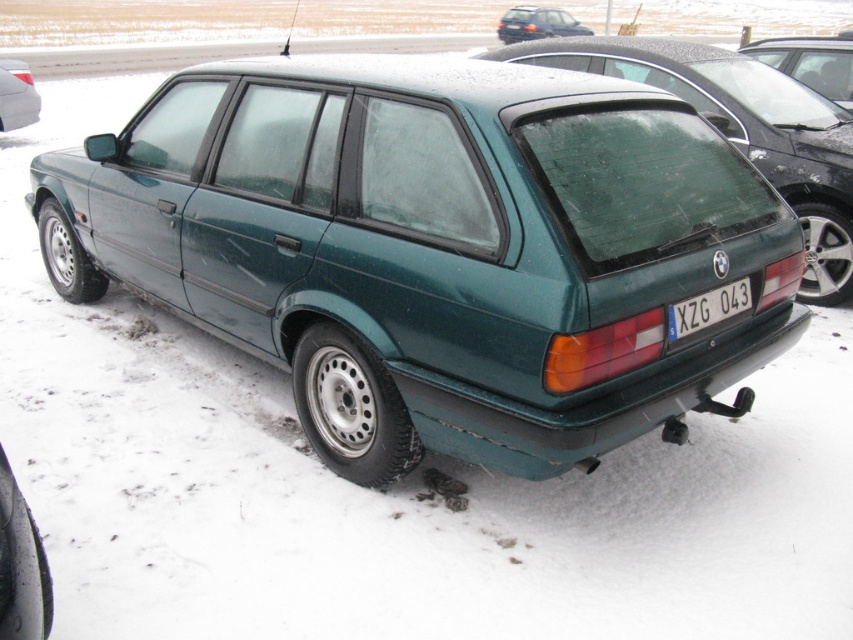
Question: Among these objects, which one is farthest from the camera?

Choices:
 (A) blue metallic license plate at center
 (B) green matte hatchback at center
 (C) green matte station wagon at upper right

Answer: (C)

Question: Where is blue metallic license plate at center located in relation to metallic green wagon at upper center in the image?

Choices:
 (A) left
 (B) right

Answer: (A)

Question: Can you confirm if green matte station wagon at upper right is wider than metallic green wagon at upper center?

Choices:
 (A) no
 (B) yes

Answer: (B)

Question: Which of these objects is positioned farthest from the green matte hatchback at center?

Choices:
 (A) metallic green wagon at upper center
 (B) green matte station wagon at upper right
 (C) metallic green car at center

Answer: (A)

Question: Considering the relative positions of green matte station wagon at upper right and metallic green wagon at upper center in the image provided, where is green matte station wagon at upper right located with respect to metallic green wagon at upper center?

Choices:
 (A) right
 (B) left

Answer: (A)

Question: Which is farther from the metallic green wagon at upper center?

Choices:
 (A) green matte car at center
 (B) green matte station wagon at upper right
 (C) blue metallic license plate at center
 (D) metallic green car at center

Answer: (C)